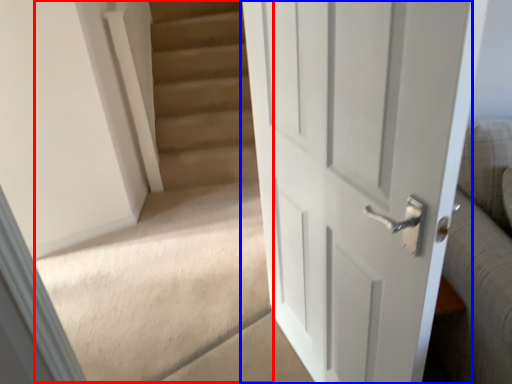
Question: Among these objects, which one is farthest to the camera, stairwell (highlighted by a red box) or door (highlighted by a blue box)?

Choices:
 (A) stairwell
 (B) door

Answer: (A)